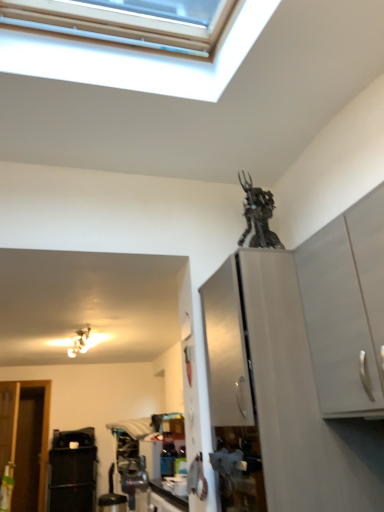
Question: From a real-world perspective, is metallic silver light fixture at upper left positioned above or below metallic statue at upper center?

Choices:
 (A) above
 (B) below

Answer: (B)

Question: Is metallic silver light fixture at upper left spatially inside metallic statue at upper center, or outside of it?

Choices:
 (A) outside
 (B) inside

Answer: (A)

Question: Based on their relative distances, which object is farther from the metallic statue at upper center?

Choices:
 (A) white matte cabinet at upper right, arranged as the 1th cabinetry when viewed from the front
 (B) satin white cabinet at upper right, the second cabinetry positioned from the front
 (C) black plastic trash can at lower left
 (D) metallic silver light fixture at upper left

Answer: (C)

Question: Estimate the real-world distances between objects in this image. Which object is farther from the black plastic trash can at lower left?

Choices:
 (A) satin white cabinet at upper right, the second cabinetry positioned from the front
 (B) metallic silver light fixture at upper left
 (C) white matte cabinet at upper right, arranged as the 1th cabinetry when viewed from the front
 (D) metallic statue at upper center

Answer: (C)